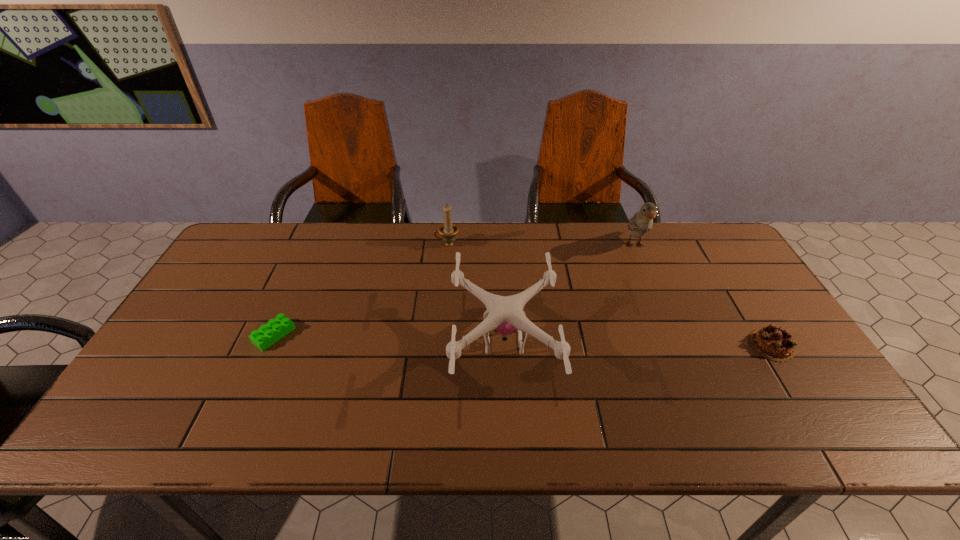
You are a GUI agent. You are given a task and a screenshot of the screen. Output one action in this format:
    pyautogui.click(x=<x>, y=<y>)
    Task: Click on the object that is at the right edge
    
    Given the screenshot: What is the action you would take?
    pyautogui.click(x=773, y=343)

The width and height of the screenshot is (960, 540). I want to click on vacant space at the far edge of the desktop, so click(x=587, y=246).

The height and width of the screenshot is (540, 960). I want to click on vacant space at the near edge of the desktop, so click(x=634, y=415).

What are the coordinates of `vacant space at the left edge of the desktop` in the screenshot? It's located at (260, 279).

Find the location of a particular element. free space at the right edge of the desktop is located at coordinates (789, 377).

The width and height of the screenshot is (960, 540). I want to click on vacant region at the far right corner of the desktop, so click(687, 259).

The width and height of the screenshot is (960, 540). I want to click on vacant space in between the drone and the fourth object from left to right, so click(x=569, y=294).

Identify the location of vacant area that lies between the drone and the shortest object. (389, 339).

Identify the location of empty location between the drone and the second object from right to left. (569, 294).

You are a GUI agent. You are given a task and a screenshot of the screen. Output one action in this format:
    pyautogui.click(x=<x>, y=<y>)
    Task: Click on the unoccupied position between the drone and the leftmost object
    
    Given the screenshot: What is the action you would take?
    pyautogui.click(x=389, y=339)